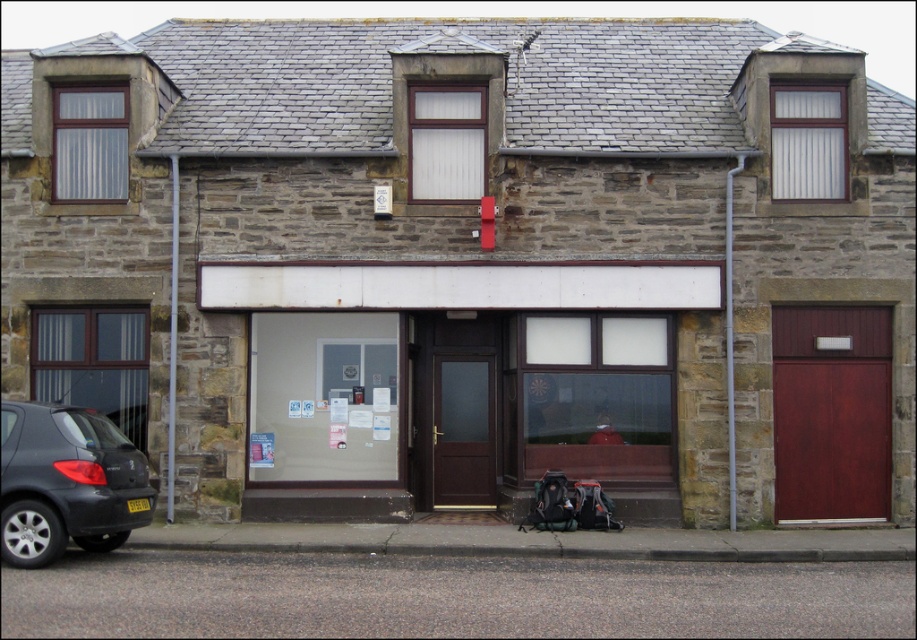
You are a delivery person trying to park your matte black car at lower left near the building. The parking space is right next to the dark brown wood door at center. Considering the height of the car and the door, will the car fit without damaging the door?

The matte black car at lower left is not as tall as the dark brown wood door at center, so the car should fit without damaging the door since it is shorter in height.

You are a delivery person trying to park your matte black car at lower left near the building. The dark brown wood door at center is the entrance. Is your car currently parked directly under the entrance?

The matte black car at lower left is positioned under the dark brown wood door at center, so yes, it is parked directly under the entrance.